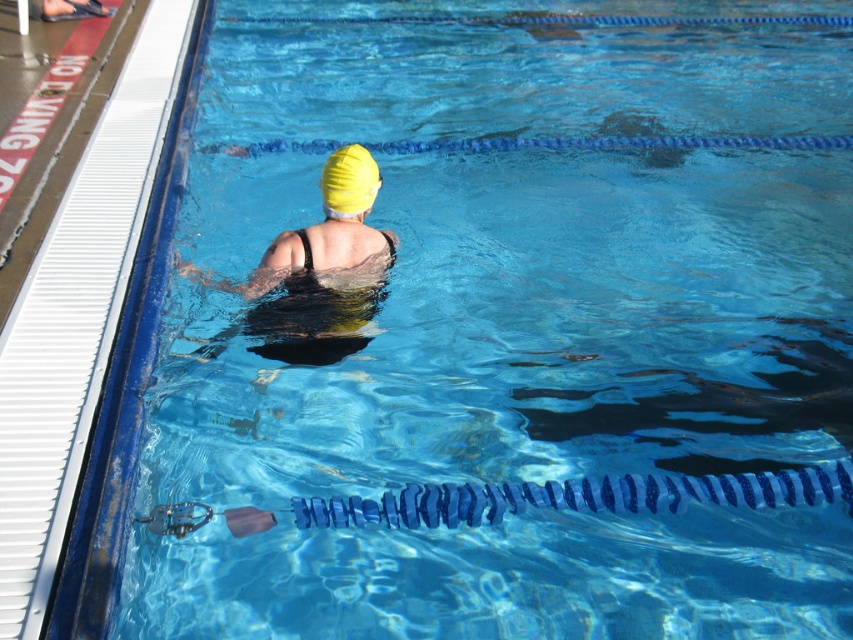
You are a lifeguard observing the pool from the deck. You notice two points marked in the pool. The first point is at coordinates point (341, 276) and the second is at point (173, 518). Which point is closer to the swimmer currently performing the freestyle stroke?

Point (173, 518) is closer to the swimmer because it is in front of point (341, 276), which is behind it.